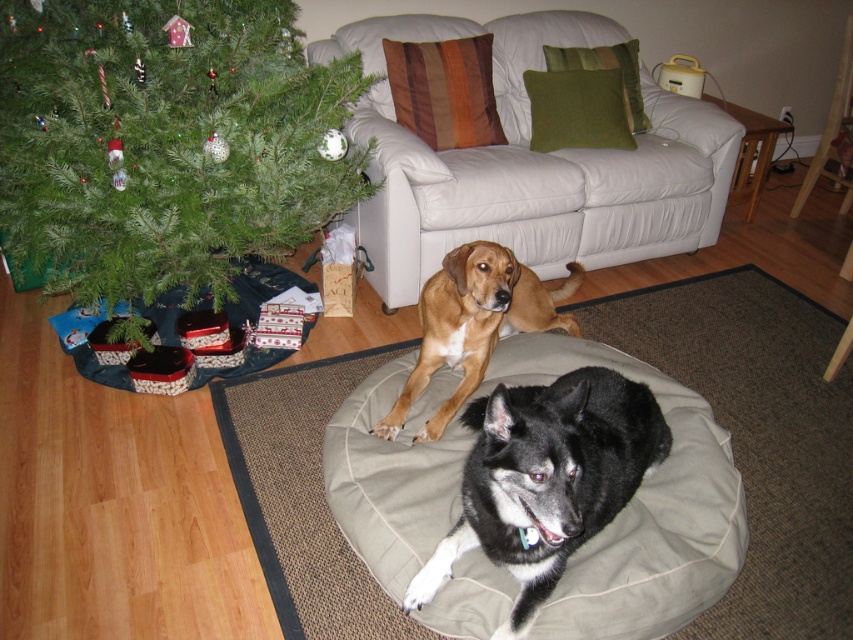
Does striped fabric pillow at upper center appear on the left side of green fabric pillow at upper center?

Correct, you'll find striped fabric pillow at upper center to the left of green fabric pillow at upper center.

Can you confirm if striped fabric pillow at upper center is wider than green fabric pillow at upper center?

Yes.

Between point (392, 72) and point (624, 54), which one is positioned behind?

The point (624, 54) is behind.

At what (x,y) coordinates should I click in order to perform the action: click on striped fabric pillow at upper center. Please return your answer as a coordinate pair (x, y). Looking at the image, I should click on (444, 90).

Can you confirm if white leather couch at upper center is positioned to the right of black fur dog at center?

Correct, you'll find white leather couch at upper center to the right of black fur dog at center.

Consider the image. Between white leather couch at upper center and black fur dog at center, which one has less height?

With less height is black fur dog at center.

Where is `white leather couch at upper center`? This screenshot has height=640, width=853. white leather couch at upper center is located at coordinates (531, 164).

Can you confirm if black fur dog at center is positioned to the right of green textured pillow at upper center?

No, black fur dog at center is not to the right of green textured pillow at upper center.

Does black fur dog at center come in front of green textured pillow at upper center?

That is True.

The width and height of the screenshot is (853, 640). What do you see at coordinates (546, 477) in the screenshot? I see `black fur dog at center` at bounding box center [546, 477].

Identify the location of black fur dog at center. (546, 477).